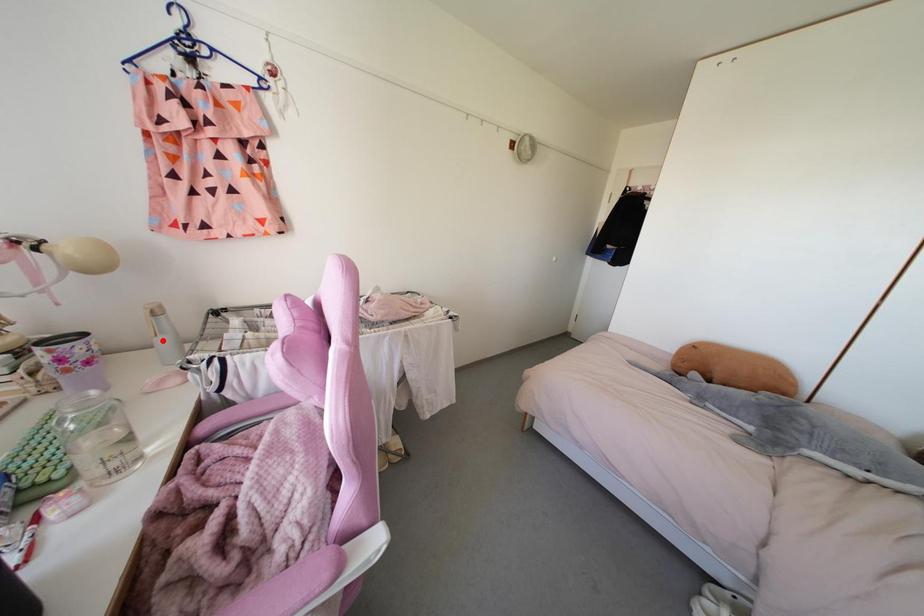
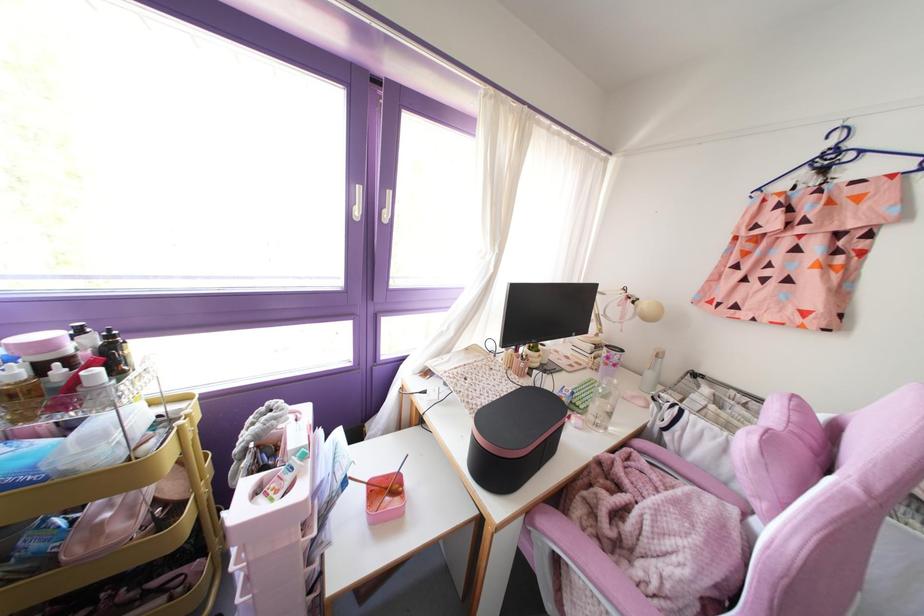
In the second image, find the point that corresponds to the highlighted location in the first image.

(649, 374)